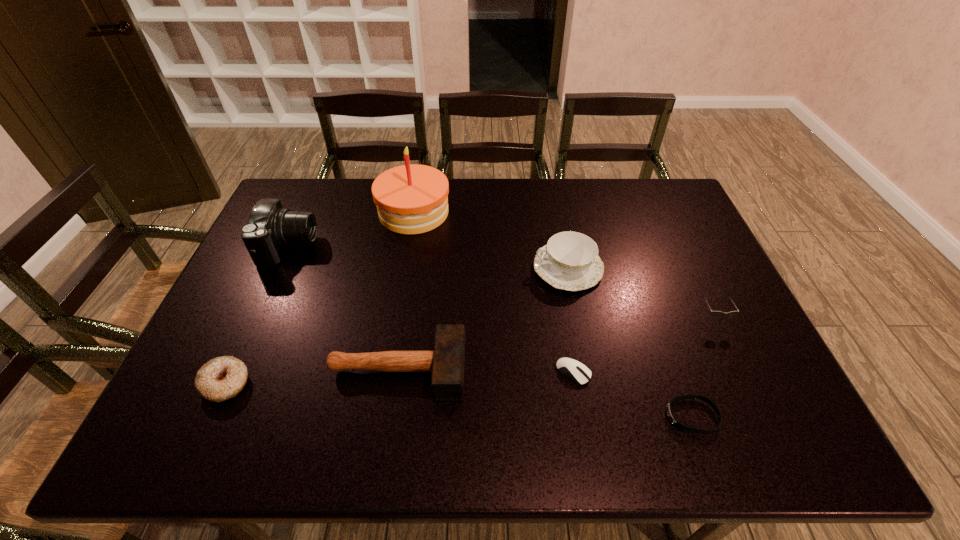
Where is `the tallest object`? The height and width of the screenshot is (540, 960). the tallest object is located at coordinates (411, 199).

Locate an element on the screen. The image size is (960, 540). the seventh shortest object is located at coordinates (269, 227).

Identify the location of chinaware. This screenshot has width=960, height=540. click(x=569, y=261).

At what (x,y) coordinates should I click in order to perform the action: click on sunglasses. Please return your answer as a coordinate pair (x, y). Looking at the image, I should click on (714, 313).

The width and height of the screenshot is (960, 540). What are the coordinates of `the rightmost object` in the screenshot? It's located at (714, 313).

You are a GUI agent. You are given a task and a screenshot of the screen. Output one action in this format:
    pyautogui.click(x=<x>, y=<y>)
    Task: Click on the mallet
    Image resolution: width=960 pixels, height=540 pixels.
    Given the screenshot: What is the action you would take?
    pyautogui.click(x=447, y=362)

Locate an element on the screen. the third shortest object is located at coordinates (222, 378).

The height and width of the screenshot is (540, 960). What are the coordinates of `mouse` in the screenshot? It's located at (576, 371).

Identify the location of the shortest object. (670, 414).

Locate an element on the screen. This screenshot has height=540, width=960. the second object from right to left is located at coordinates (670, 414).